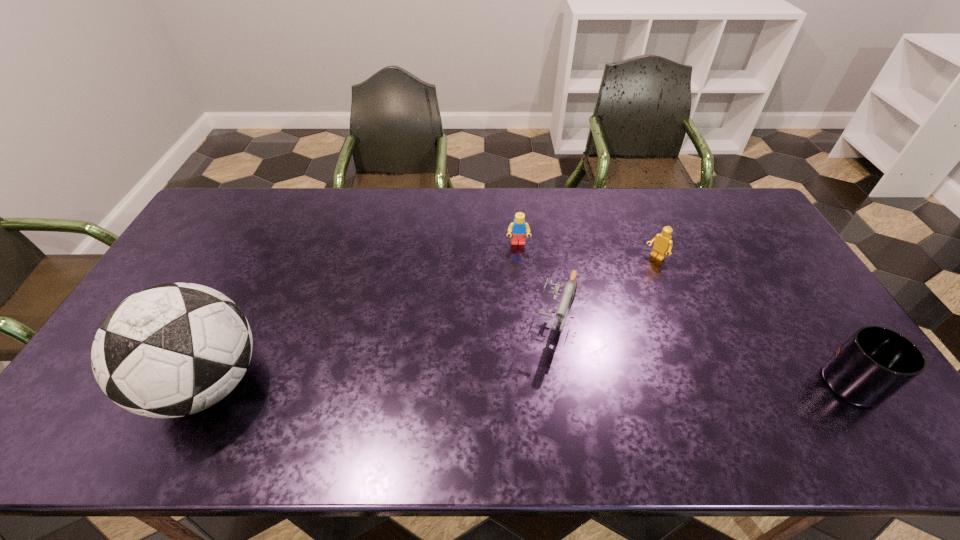
At what (x,y) coordinates should I click in order to perform the action: click on soccer ball located in the near edge section of the desktop. Please return your answer as a coordinate pair (x, y). This screenshot has width=960, height=540. Looking at the image, I should click on (171, 350).

Find the location of a particular element. mug present at the near edge is located at coordinates click(876, 362).

Find the location of `object that is at the left edge`. object that is at the left edge is located at coordinates (171, 350).

I want to click on object that is at the right edge, so click(x=876, y=362).

Where is `object that is at the near left corner`? Image resolution: width=960 pixels, height=540 pixels. object that is at the near left corner is located at coordinates (171, 350).

You are a GUI agent. You are given a task and a screenshot of the screen. Output one action in this format:
    pyautogui.click(x=<x>, y=<y>)
    Task: Click on the object that is at the near right corner
    
    Given the screenshot: What is the action you would take?
    pyautogui.click(x=876, y=362)

The image size is (960, 540). I want to click on free space at the far edge, so coord(537,228).

This screenshot has height=540, width=960. I want to click on blank space at the near edge of the desktop, so click(444, 383).

What are the coordinates of `vacant space at the right edge of the desktop` in the screenshot? It's located at (785, 335).

The width and height of the screenshot is (960, 540). Identify the location of free space at the far left corner. (212, 215).